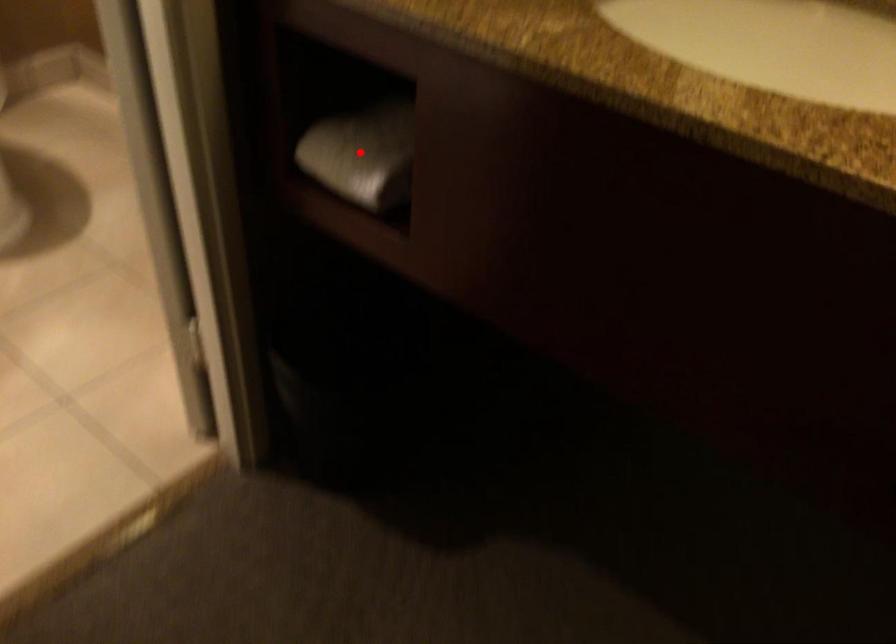
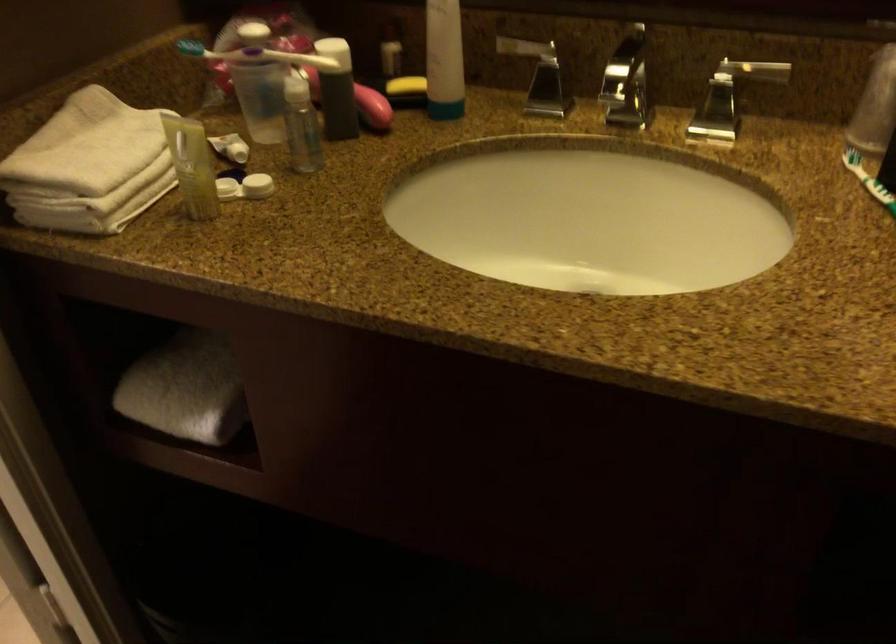
Find the pixel in the second image that matches the highlighted location in the first image.

(185, 389)